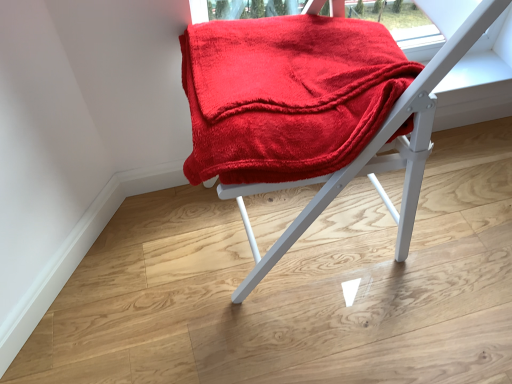
Find the location of a particular element. fuzzy red blanket at center is located at coordinates click(x=376, y=153).

Consider the image. What is the approximate width of fuzzy red blanket at center?

22.45 inches.

The image size is (512, 384). What do you see at coordinates (376, 153) in the screenshot?
I see `fuzzy red blanket at center` at bounding box center [376, 153].

At what (x,y) coordinates should I click in order to perform the action: click on fuzzy red blanket at center. Please return your answer as a coordinate pair (x, y). Image resolution: width=512 pixels, height=384 pixels. Looking at the image, I should click on (376, 153).